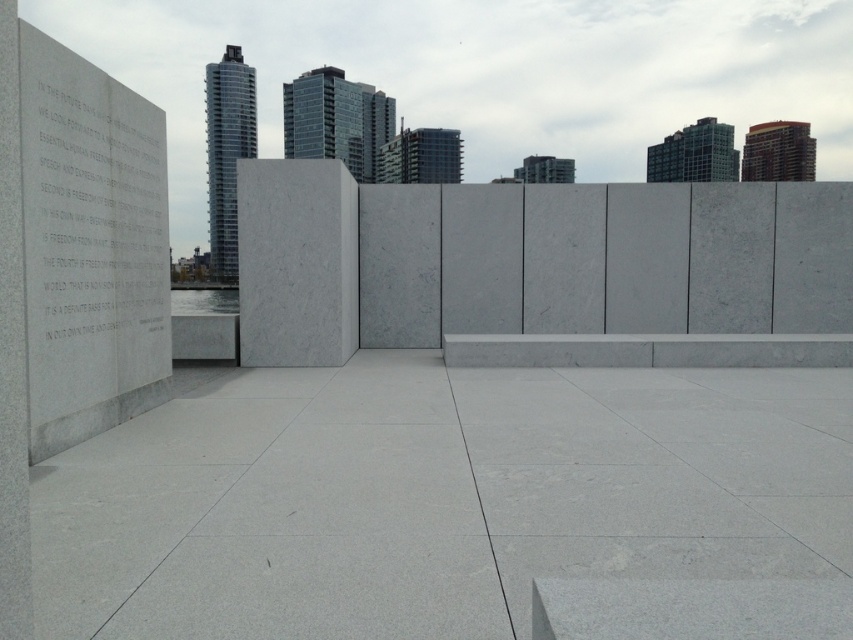
You are standing at the center of the open urban space and want to read the text on the white marble plaque at left. Which direction should you face to see it clearly?

The white marble plaque at left is located at point (94, 212), so you should face towards the left side of the frame to see it clearly.

You are designing a layout for a new exhibit and need to place a 1.2 meter wide sculpture. You have two options for placement areas in the scene described. The white marble plaque at left and the white marble ledge at center. Which area can accommodate the sculpture based on their widths?

The white marble ledge at center has a greater width than the white marble plaque at left. Since the sculpture is 1.2 meters wide, the white marble ledge at center is the suitable option as it can accommodate the sculpture.